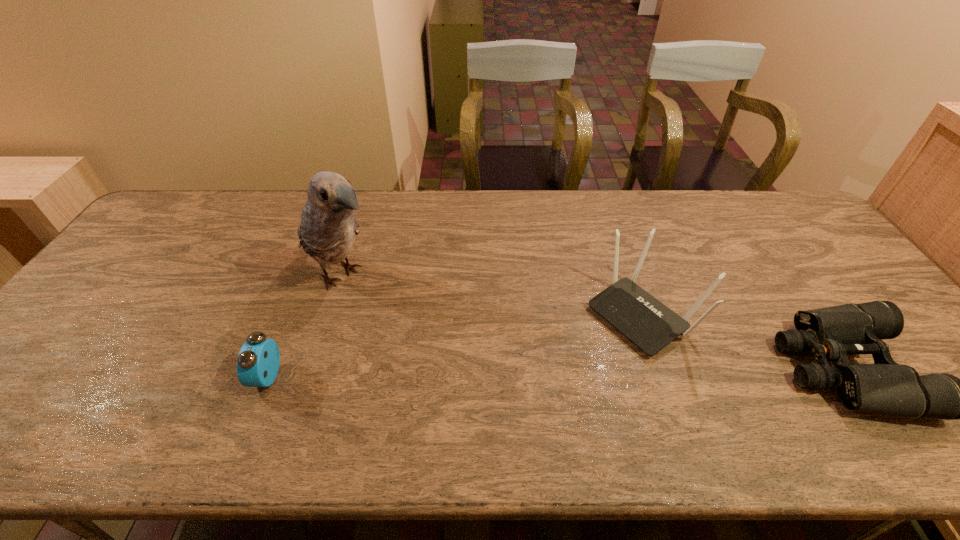
At what (x,y) coordinates should I click in order to perform the action: click on vacant region that satisfies the following two spatial constraints: 1. on the front side of the shortest object; 2. through the eyepieces of the parrot. Please return your answer as a coordinate pair (x, y). Looking at the image, I should click on (313, 368).